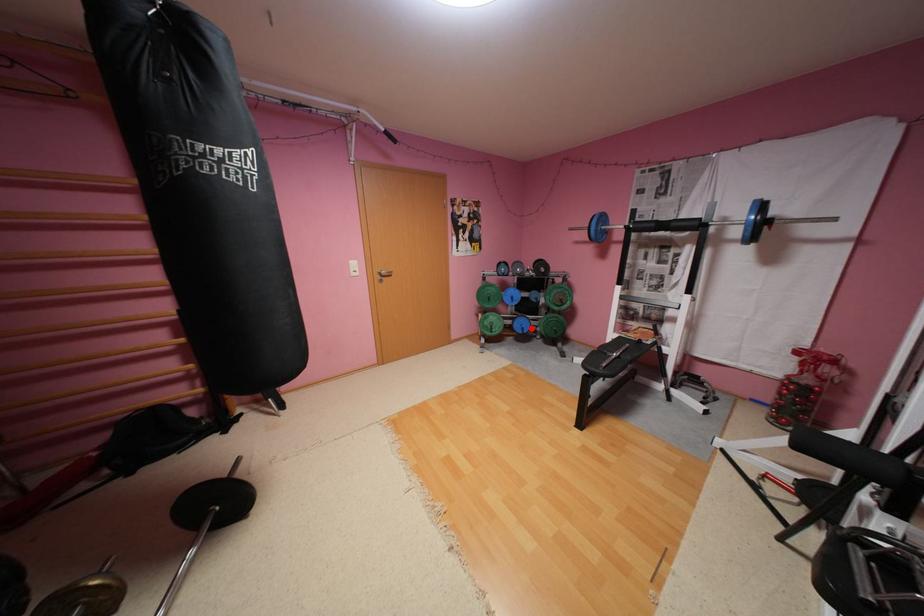
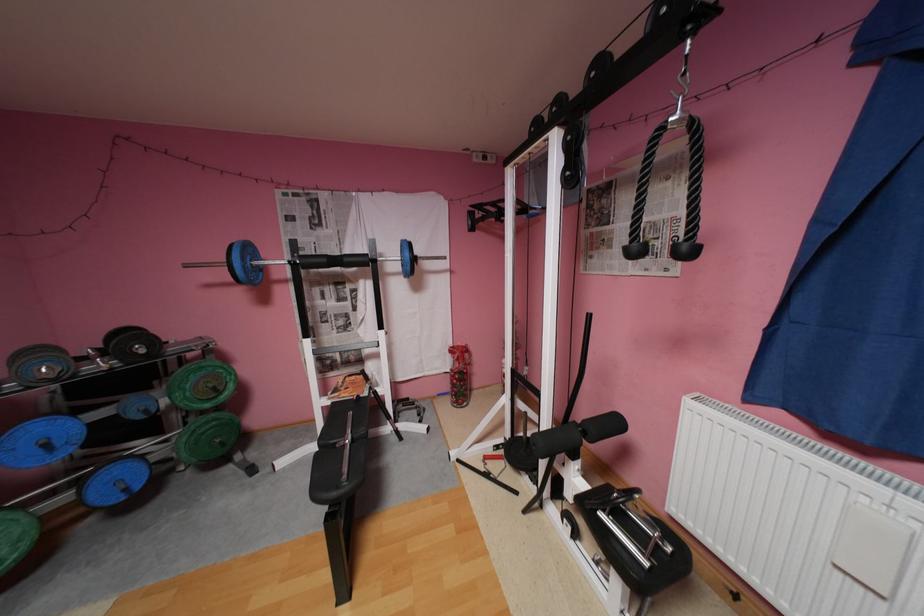
Where in the second image is the point corresponding to the highlighted location from the first image?

(134, 488)